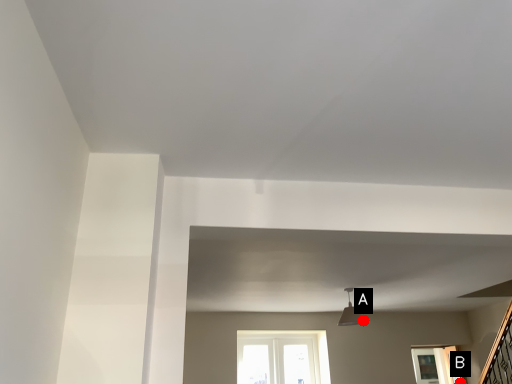
Question: Two points are circled on the image, labeled by A and B beside each circle. Which of the following is the closest to the observer?

Choices:
 (A) A is closer
 (B) B is closer

Answer: (A)